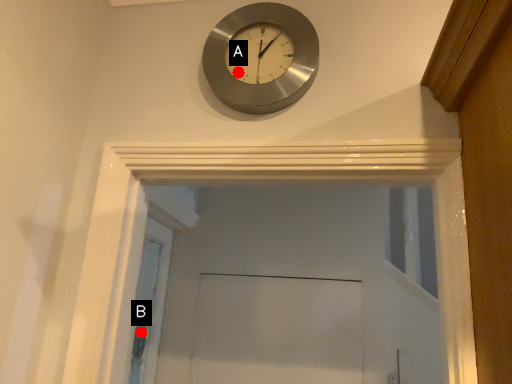
Question: Two points are circled on the image, labeled by A and B beside each circle. Which point is further to the camera?

Choices:
 (A) A is further
 (B) B is further

Answer: (B)